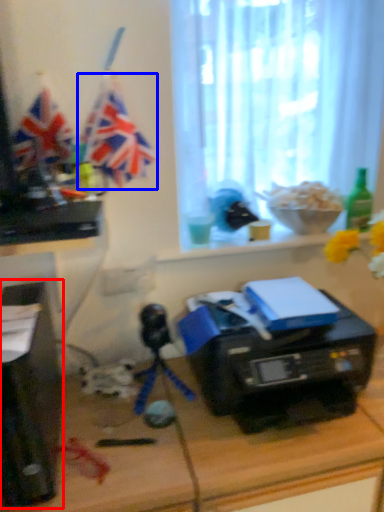
Question: Which point is further to the camera, desktop computer (highlighted by a red box) or flag (highlighted by a blue box)?

Choices:
 (A) desktop computer
 (B) flag

Answer: (B)